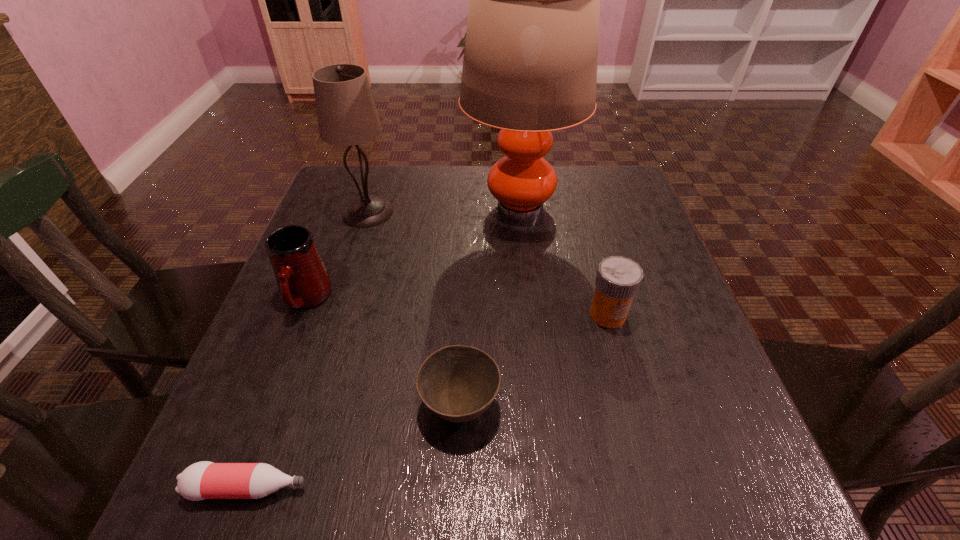
This screenshot has width=960, height=540. What are the coordinates of `the tallest object` in the screenshot? It's located at (530, 61).

You are a GUI agent. You are given a task and a screenshot of the screen. Output one action in this format:
    pyautogui.click(x=<x>, y=<y>)
    Task: Click on the fifth shortest object
    The height and width of the screenshot is (540, 960).
    Given the screenshot: What is the action you would take?
    pyautogui.click(x=346, y=112)

You are a GUI agent. You are given a task and a screenshot of the screen. Output one action in this format:
    pyautogui.click(x=<x>, y=<y>)
    Task: Click on the third tallest object
    Image resolution: width=960 pixels, height=540 pixels.
    Given the screenshot: What is the action you would take?
    pyautogui.click(x=303, y=281)

This screenshot has width=960, height=540. I want to click on medicine, so click(618, 279).

At what (x,y) coordinates should I click in order to perform the action: click on bowl. Please return your answer as a coordinate pair (x, y). This screenshot has width=960, height=540. Looking at the image, I should click on (458, 383).

Locate an element on the screen. the fifth tallest object is located at coordinates (458, 383).

Find the location of a particular element. This screenshot has height=540, width=960. the nearest object is located at coordinates (203, 480).

You are a GUI agent. You are given a task and a screenshot of the screen. Output one action in this format:
    pyautogui.click(x=<x>, y=<y>)
    Task: Click on the shortest object
    The image size is (960, 540).
    Given the screenshot: What is the action you would take?
    pyautogui.click(x=203, y=480)

Identify the location of vacant space located 0.340m on the left of the tallest object. This screenshot has width=960, height=540. (330, 207).

In order to click on vacant point located 0.340m on the front-facing side of the second tallest object in this screenshot , I will do `click(528, 212)`.